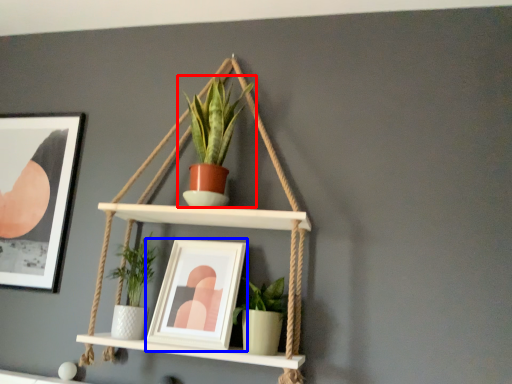
Question: Which of the following is the farthest to the observer, houseplant (highlighted by a red box) or picture frame (highlighted by a blue box)?

Choices:
 (A) houseplant
 (B) picture frame

Answer: (A)